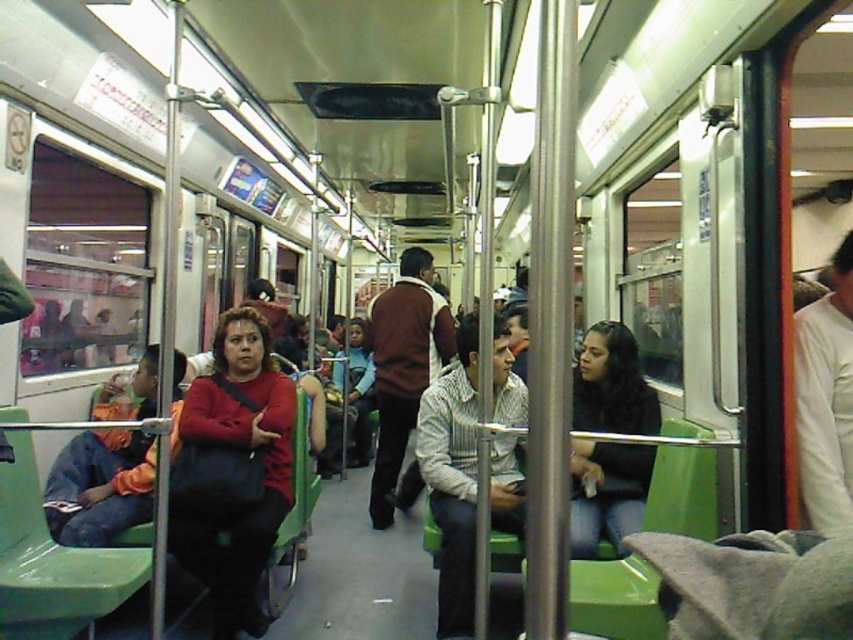
Question: Which is farther from the dark brown sweater at center?

Choices:
 (A) matte red sweater at center
 (B) striped cotton shirt at center
 (C) denim jacket at left
 (D) brown sweater at center

Answer: (C)

Question: Which of the following is the farthest from the observer?

Choices:
 (A) brown sweater at center
 (B) matte red sweater at center

Answer: (A)

Question: Can you confirm if striped cotton shirt at center is positioned below brown sweater at center?

Choices:
 (A) no
 (B) yes

Answer: (A)

Question: Which point is closer to the camera?

Choices:
 (A) brown sweater at center
 (B) matte red sweater at center
 (C) striped cotton shirt at center

Answer: (C)

Question: Can you confirm if matte red sweater at center is smaller than denim jacket at left?

Choices:
 (A) no
 (B) yes

Answer: (B)

Question: Does striped cotton shirt at center appear on the left side of dark brown sweater at center?

Choices:
 (A) yes
 (B) no

Answer: (A)